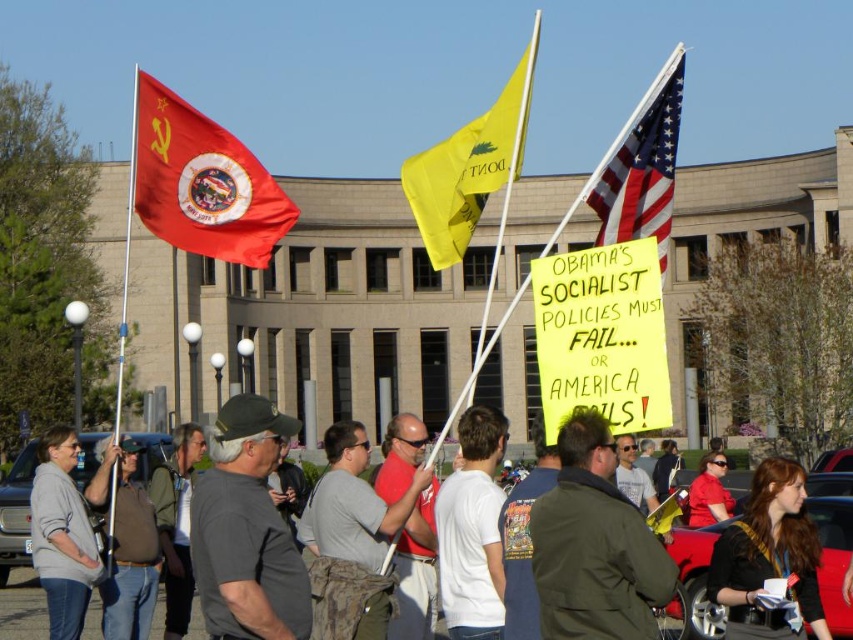
Based on the photo, which of these two, dark brown leather jacket at lower right or yellow fabric flag at center, stands shorter?

dark brown leather jacket at lower right is shorter.

The height and width of the screenshot is (640, 853). Describe the element at coordinates (769, 560) in the screenshot. I see `dark brown leather jacket at lower right` at that location.

Where is `dark brown leather jacket at lower right`? This screenshot has height=640, width=853. dark brown leather jacket at lower right is located at coordinates tap(769, 560).

Does red fabric flag at upper left appear on the left side of american flag at center?

Yes, red fabric flag at upper left is to the left of american flag at center.

Who is more distant from viewer, [136,77] or [599,214]?

Positioned behind is point [136,77].

At what (x,y) coordinates should I click in order to perform the action: click on red fabric flag at upper left. Please return your answer as a coordinate pair (x, y). The height and width of the screenshot is (640, 853). Looking at the image, I should click on (201, 182).

Between red fabric flag at upper left and dark brown leather jacket at lower right, which one has more height?

red fabric flag at upper left

Who is more forward, (247, 188) or (813, 531)?

Point (813, 531) is more forward.

Identify the location of red fabric flag at upper left. The height and width of the screenshot is (640, 853). (201, 182).

Where is `red fabric flag at upper left`? This screenshot has height=640, width=853. red fabric flag at upper left is located at coordinates (201, 182).